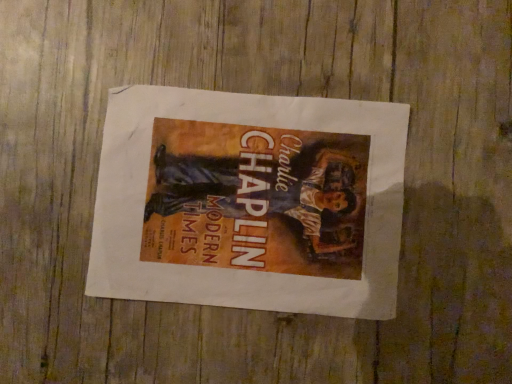
Describe the element at coordinates (250, 201) in the screenshot. This screenshot has height=384, width=512. I see `matte paper poster at center` at that location.

Image resolution: width=512 pixels, height=384 pixels. What are the coordinates of `matte paper poster at center` in the screenshot? It's located at (250, 201).

What are the coordinates of `matte paper poster at center` in the screenshot? It's located at (250, 201).